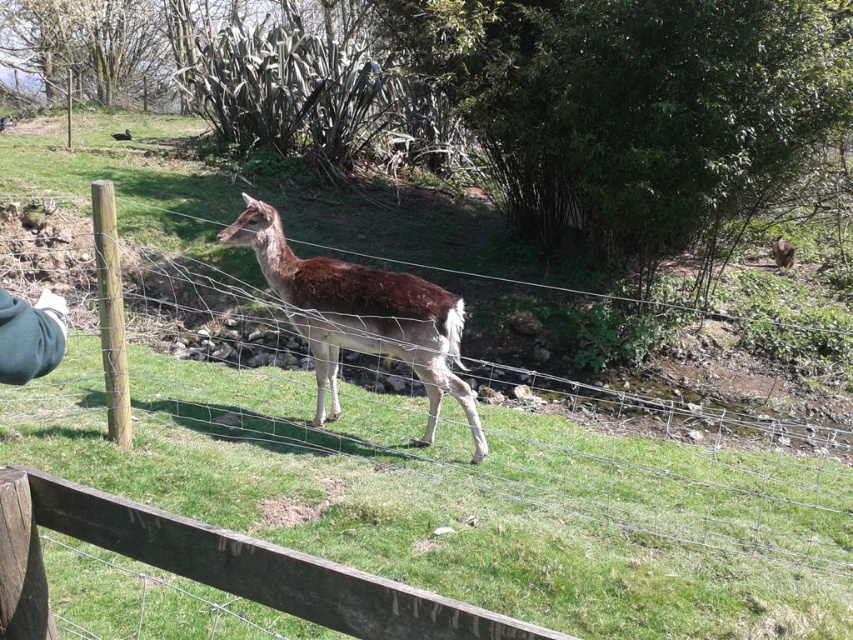
Question: Which object is farther from the camera taking this photo?

Choices:
 (A) wooden fence at center
 (B) brown fur deer at center
 (C) brown speckled fur at center

Answer: (B)

Question: Which point is closer to the camera?

Choices:
 (A) (125, 294)
 (B) (780, 252)

Answer: (A)

Question: Among these objects, which one is nearest to the camera?

Choices:
 (A) brown speckled fur at center
 (B) wooden fence at center

Answer: (B)

Question: In this image, where is brown speckled fur at center located relative to brown fur deer at center?

Choices:
 (A) below
 (B) above

Answer: (A)

Question: Does wooden fence at center appear on the right side of brown speckled fur at center?

Choices:
 (A) yes
 (B) no

Answer: (B)

Question: Can you confirm if wooden fence at center is wider than brown speckled fur at center?

Choices:
 (A) yes
 (B) no

Answer: (B)